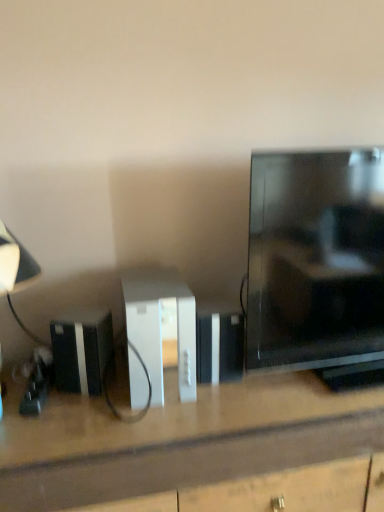
At what (x,y) coordinates should I click in order to perform the action: click on empty space that is ontop of white matte desk at center. Please return your answer as a coordinate pair (x, y). Looking at the image, I should click on (186, 397).